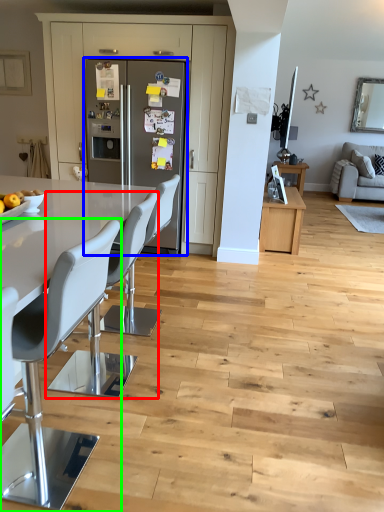
Question: Which object is the closest to the chair (highlighted by a red box)? Choose among these: fridge (highlighted by a blue box) or chair (highlighted by a green box).

Choices:
 (A) fridge
 (B) chair

Answer: (B)